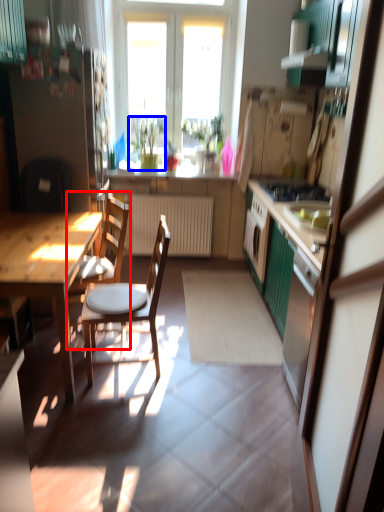
Question: Which object is further to the camera taking this photo, chair (highlighted by a red box) or houseplant (highlighted by a blue box)?

Choices:
 (A) chair
 (B) houseplant

Answer: (B)